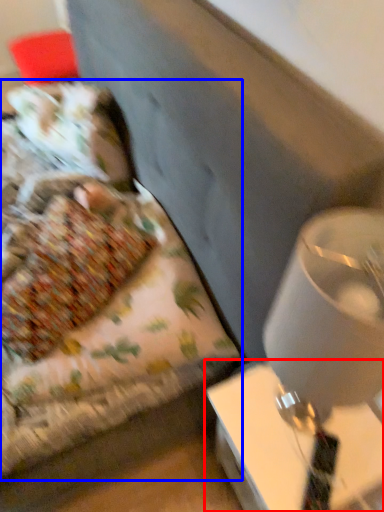
Question: Which of the following is the closest to the observer, table (highlighted by a red box) or bed (highlighted by a blue box)?

Choices:
 (A) table
 (B) bed

Answer: (A)